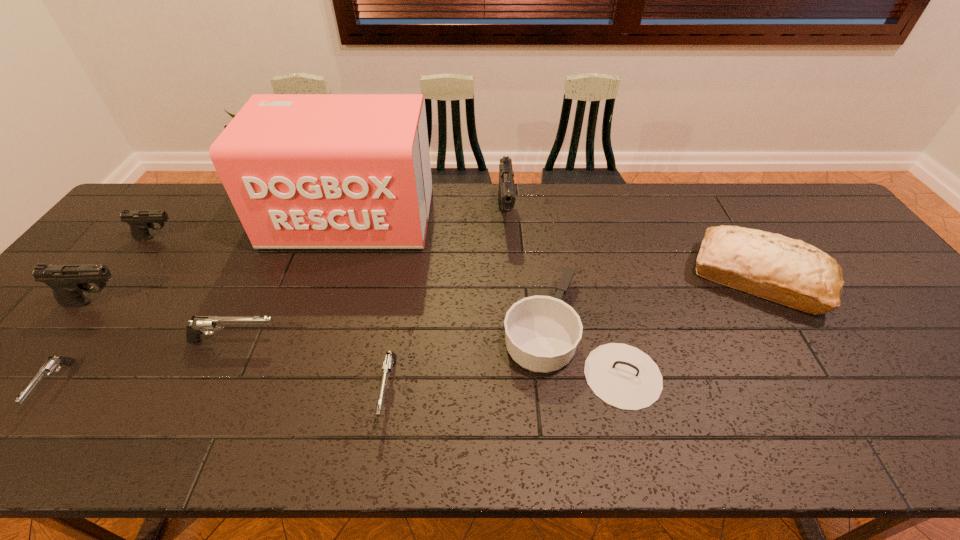
At what (x,y) coordinates should I click in order to perform the action: click on saucepan. Please return your answer as a coordinate pair (x, y). The image size is (960, 540). Looking at the image, I should click on (542, 332).

Locate an element on the screen. This screenshot has width=960, height=540. the second shortest pistol is located at coordinates (390, 359).

Identify the location of the second pistol from right to left. This screenshot has width=960, height=540. (390, 359).

This screenshot has width=960, height=540. Find the location of `the smallest silver pistol`. the smallest silver pistol is located at coordinates (49, 366).

Identify the location of the leftmost silver pistol. (49, 366).

The width and height of the screenshot is (960, 540). Find the location of `vacant space situated 0.320m on the surface of the pink box where the text is embossed`. vacant space situated 0.320m on the surface of the pink box where the text is embossed is located at coordinates (309, 347).

Locate an element on the screen. The width and height of the screenshot is (960, 540). blank space located 0.360m at the barrel of the second tallest object is located at coordinates (514, 339).

Locate an element on the screen. This screenshot has height=540, width=960. vacant area situated at the barrel of the second biggest black pistol is located at coordinates (178, 302).

The width and height of the screenshot is (960, 540). Identify the location of vacant space located 0.260m on the back of the bread. (706, 190).

This screenshot has height=540, width=960. In order to click on free region located 0.280m at the barrel of the smallest black pistol in this screenshot , I will do (274, 238).